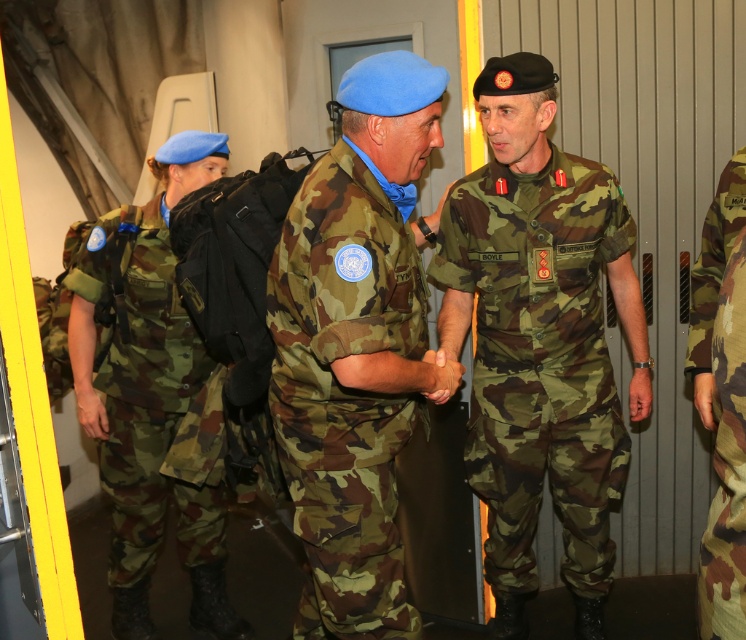
Between camo fabric uniform at center and camo fabric uniform at left, which one has less height?

Standing shorter between the two is camo fabric uniform at center.

Is camo fabric uniform at center to the left of camo fabric uniform at left from the viewer's perspective?

No, camo fabric uniform at center is not to the left of camo fabric uniform at left.

Image resolution: width=746 pixels, height=640 pixels. Find the location of `camo fabric uniform at center`. camo fabric uniform at center is located at coordinates (344, 392).

Can you confirm if camo fabric uniform at left is thinner than camouflage fabric uniform at right?

Incorrect, camo fabric uniform at left's width is not less than camouflage fabric uniform at right's.

Is camo fabric uniform at left wider than camouflage fabric uniform at right?

Yes.

Which is behind, point (87, 259) or point (730, 301)?

The point (87, 259) is more distant.

This screenshot has height=640, width=746. Find the location of `camo fabric uniform at left`. camo fabric uniform at left is located at coordinates (147, 400).

Which of these two, camouflage fabric uniform at center or camo fabric uniform at left, stands shorter?

Standing shorter between the two is camo fabric uniform at left.

Does point (521, 563) come closer to viewer compared to point (125, 300)?

That is False.

You are a GUI agent. You are given a task and a screenshot of the screen. Output one action in this format:
    pyautogui.click(x=<x>, y=<y>)
    Task: Click on the camouflage fabric uniform at center
    Image resolution: width=746 pixels, height=640 pixels.
    Given the screenshot: What is the action you would take?
    pyautogui.click(x=539, y=358)

This screenshot has height=640, width=746. What are the coordinates of `camouflage fabric uniform at center` in the screenshot? It's located at (539, 358).